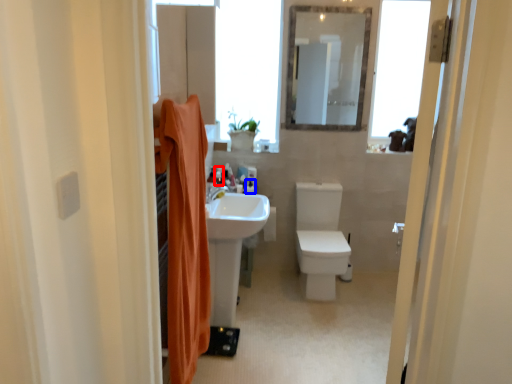
Question: Which object is closer to the camera taking this photo, toiletry (highlighted by a red box) or toiletry (highlighted by a blue box)?

Choices:
 (A) toiletry
 (B) toiletry

Answer: (B)